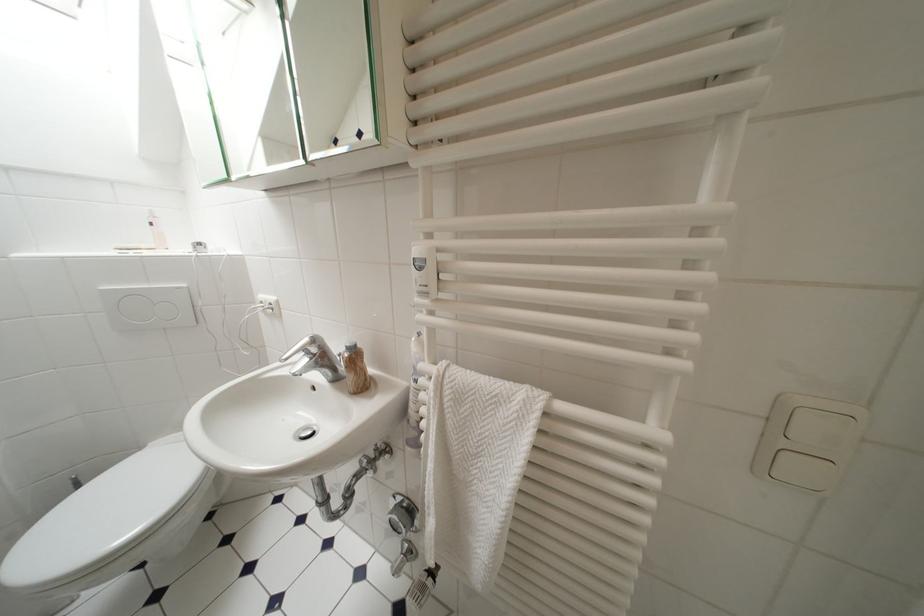
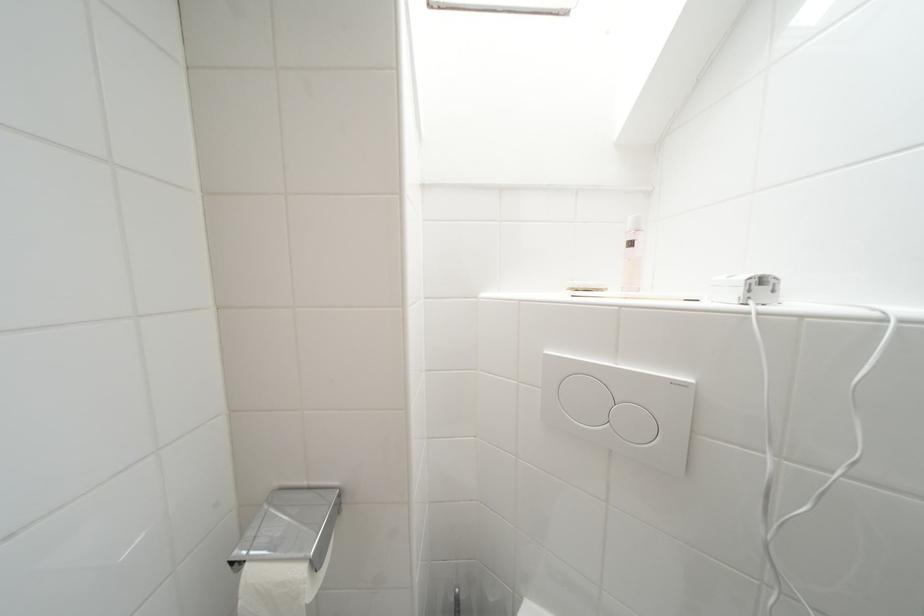
Where in the second image is the point corresponding to (x=207, y=246) from the first image?

(769, 283)